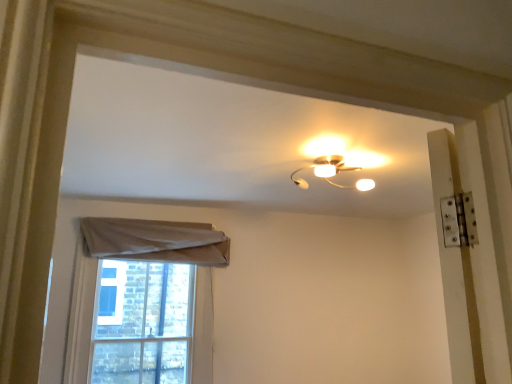
Question: Can you confirm if light beige fabric at lower left is shorter than matte white lamp at upper center?

Choices:
 (A) no
 (B) yes

Answer: (A)

Question: Is light beige fabric at lower left with matte white lamp at upper center?

Choices:
 (A) yes
 (B) no

Answer: (B)

Question: Does light beige fabric at lower left have a greater height compared to matte white lamp at upper center?

Choices:
 (A) yes
 (B) no

Answer: (A)

Question: Is matte white lamp at upper center at the back of light beige fabric at lower left?

Choices:
 (A) yes
 (B) no

Answer: (B)

Question: Does light beige fabric at lower left appear on the left side of matte white lamp at upper center?

Choices:
 (A) no
 (B) yes

Answer: (B)

Question: Can you confirm if light beige fabric at lower left is thinner than matte white lamp at upper center?

Choices:
 (A) no
 (B) yes

Answer: (B)

Question: Considering the relative sizes of matte white lamp at upper center and light beige fabric at lower left in the image provided, is matte white lamp at upper center bigger than light beige fabric at lower left?

Choices:
 (A) no
 (B) yes

Answer: (A)

Question: Is matte white lamp at upper center outside light beige fabric at lower left?

Choices:
 (A) no
 (B) yes

Answer: (B)

Question: From the image's perspective, is matte white lamp at upper center below light beige fabric at lower left?

Choices:
 (A) yes
 (B) no

Answer: (B)

Question: Considering the relative sizes of matte white lamp at upper center and light beige fabric at lower left in the image provided, is matte white lamp at upper center wider than light beige fabric at lower left?

Choices:
 (A) yes
 (B) no

Answer: (A)

Question: From a real-world perspective, is matte white lamp at upper center on light beige fabric at lower left?

Choices:
 (A) no
 (B) yes

Answer: (B)

Question: Considering the relative sizes of matte white lamp at upper center and light beige fabric at lower left in the image provided, is matte white lamp at upper center shorter than light beige fabric at lower left?

Choices:
 (A) no
 (B) yes

Answer: (B)

Question: Which is correct: matte white lamp at upper center is inside light beige fabric at lower left, or outside of it?

Choices:
 (A) outside
 (B) inside

Answer: (A)